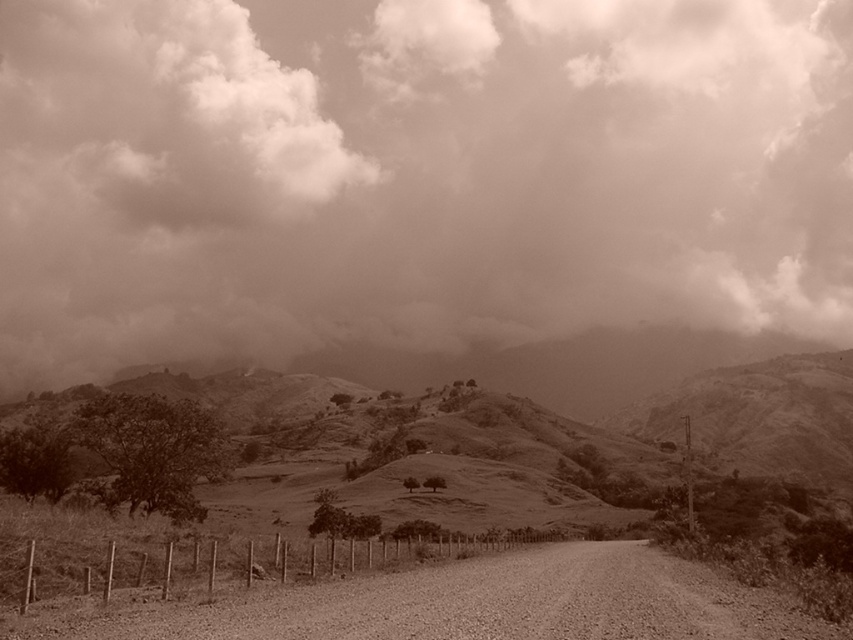
Question: Which object is farther from the camera taking this photo?

Choices:
 (A) cloudy sky at upper center
 (B) dirt/gravel road at center

Answer: (A)

Question: Among these points, which one is farthest from the camera?

Choices:
 (A) (772, 593)
 (B) (438, 65)

Answer: (B)

Question: Does cloudy sky at upper center appear under dirt/gravel road at center?

Choices:
 (A) yes
 (B) no

Answer: (B)

Question: Can you confirm if cloudy sky at upper center is wider than dirt/gravel road at center?

Choices:
 (A) yes
 (B) no

Answer: (A)

Question: Which of the following is the farthest from the observer?

Choices:
 (A) cloudy sky at upper center
 (B) dirt/gravel road at center

Answer: (A)

Question: Is cloudy sky at upper center behind dirt/gravel road at center?

Choices:
 (A) no
 (B) yes

Answer: (B)